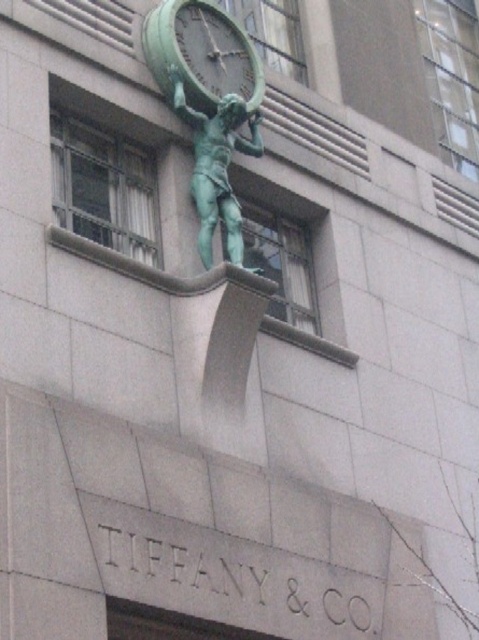
Question: Is the position of green patina clock at upper center less distant than that of green patina statue at center?

Choices:
 (A) no
 (B) yes

Answer: (A)

Question: Is the position of green patina clock at upper center more distant than that of green patina statue at center?

Choices:
 (A) no
 (B) yes

Answer: (B)

Question: Is green patina clock at upper center bigger than green patina statue at center?

Choices:
 (A) yes
 (B) no

Answer: (A)